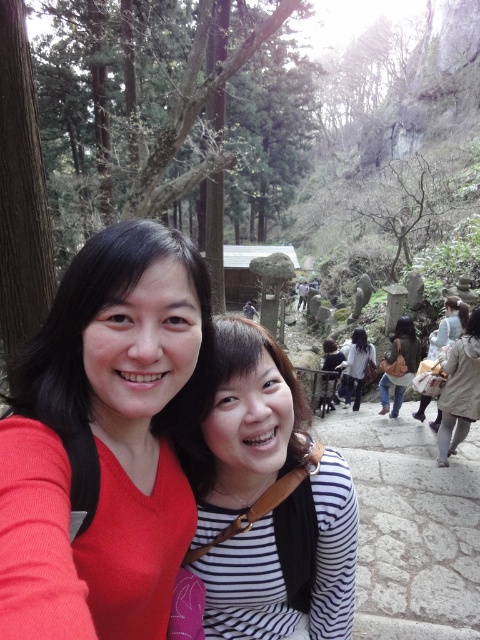
Between matte red sweater at left and striped fabric shirt at center, which one has less height?

With less height is matte red sweater at left.

This screenshot has height=640, width=480. What do you see at coordinates (106, 440) in the screenshot?
I see `matte red sweater at left` at bounding box center [106, 440].

The height and width of the screenshot is (640, 480). I want to click on matte red sweater at left, so click(106, 440).

Is gray stone steps at lower right thinner than white cotton shirt at center?

Indeed, gray stone steps at lower right has a lesser width compared to white cotton shirt at center.

Does point (405, 509) come closer to viewer compared to point (368, 356)?

Yes, it is.

Identify the location of gray stone steps at lower right. (410, 525).

How far apart are striped fabric shirt at center and gray stone steps at lower right?

striped fabric shirt at center and gray stone steps at lower right are 12.82 feet apart from each other.

Who is more forward, (292, 600) or (469, 554)?

Point (292, 600) is more forward.

You are a GUI agent. You are given a task and a screenshot of the screen. Output one action in this format:
    pyautogui.click(x=<x>, y=<y>)
    Task: Click on the striped fabric shirt at center
    This screenshot has height=640, width=480.
    Given the screenshot: What is the action you would take?
    pyautogui.click(x=267, y=500)

The image size is (480, 640). In order to click on striped fabric shirt at center in this screenshot , I will do `click(267, 500)`.